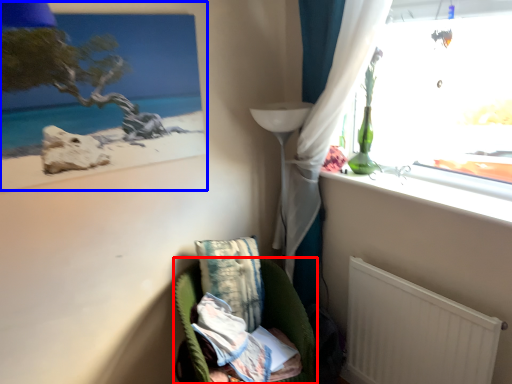
Question: Which object is closer to the camera taking this photo, furniture (highlighted by a red box) or picture frame (highlighted by a blue box)?

Choices:
 (A) furniture
 (B) picture frame

Answer: (B)